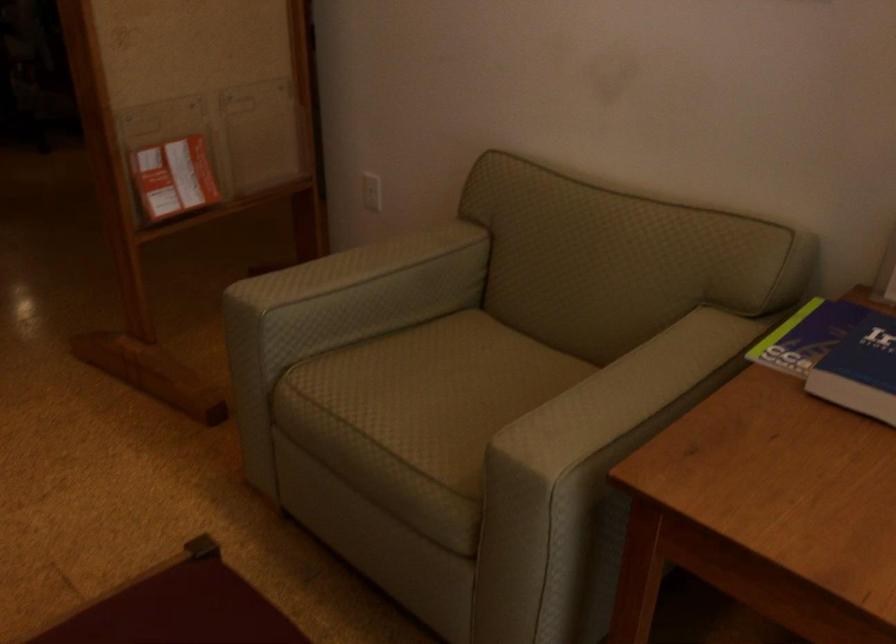
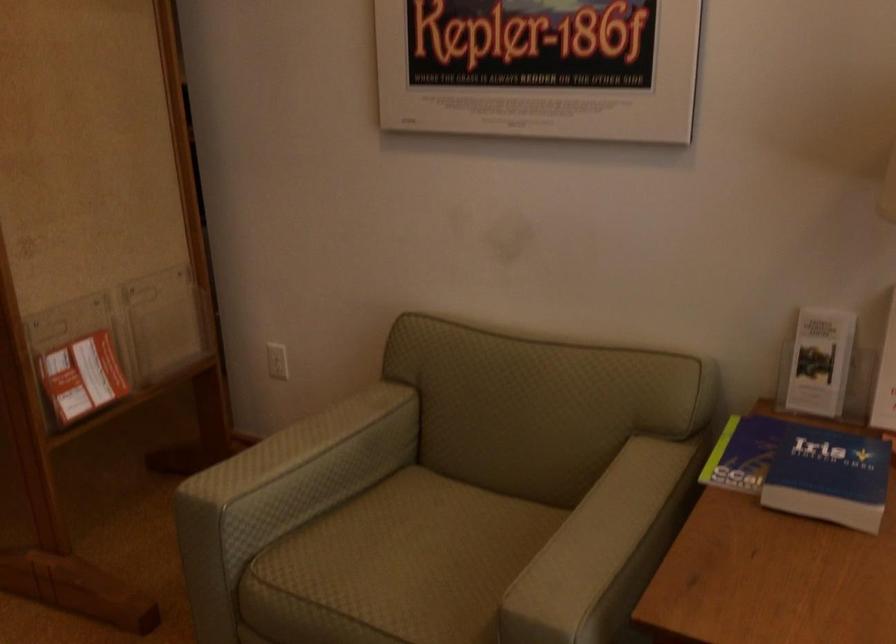
Where in the second image is the point corresponding to point 168,175 from the first image?

(82, 377)